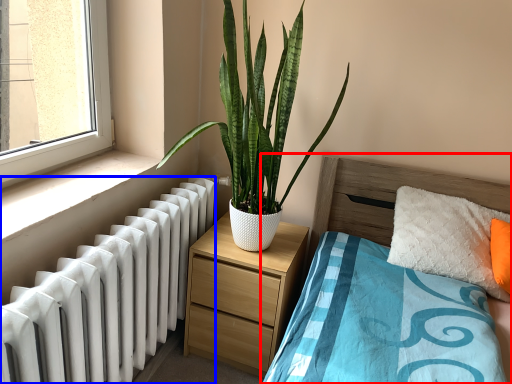
Question: Which object appears farthest to the camera in this image, bed (highlighted by a red box) or radiator (highlighted by a blue box)?

Choices:
 (A) bed
 (B) radiator

Answer: (B)